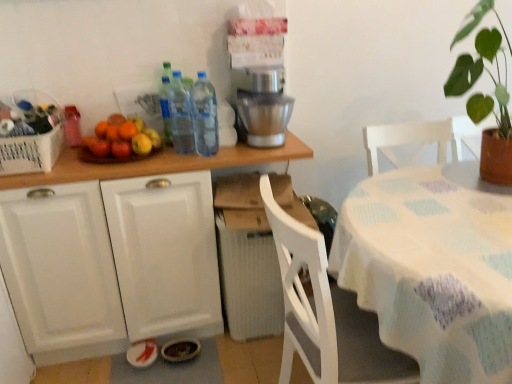
Find the location of a particular element. This screenshot has height=384, width=512. spots to the right of translucent plastic bottles at upper center, which is the second bottle in left-to-right order is located at coordinates (237, 151).